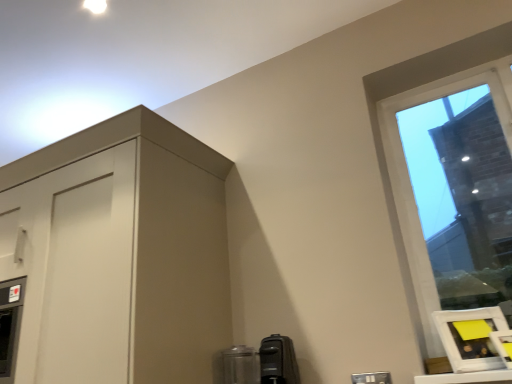
Question: Considering their positions, is white matte picture frame at lower right located in front of or behind clear glass window at upper right?

Choices:
 (A) behind
 (B) front

Answer: (B)

Question: From the image's perspective, is white matte picture frame at lower right above or below clear glass window at upper right?

Choices:
 (A) above
 (B) below

Answer: (B)

Question: Estimate the real-world distances between objects in this image. Which object is closer to the clear glass window at upper right?

Choices:
 (A) black plastic coffee maker at lower center, the 1th appliance viewed from the right
 (B) white matte picture frame at lower right
 (C) matte white cabinet at upper left
 (D) satin black coffee maker at lower center, acting as the 2th appliance starting from the right

Answer: (B)

Question: Which object is the closest to the black plastic coffee maker at lower center, the 2th appliance viewed from the left?

Choices:
 (A) clear glass window at upper right
 (B) white matte picture frame at lower right
 (C) satin black coffee maker at lower center, acting as the 2th appliance starting from the right
 (D) matte white cabinet at upper left

Answer: (C)